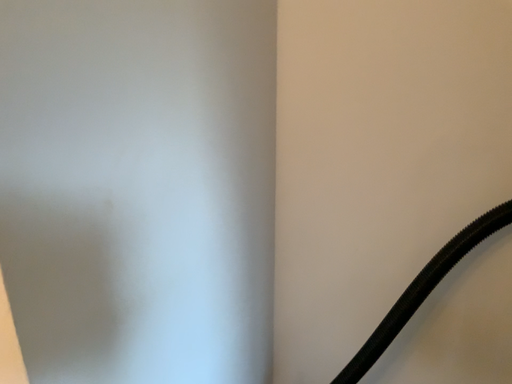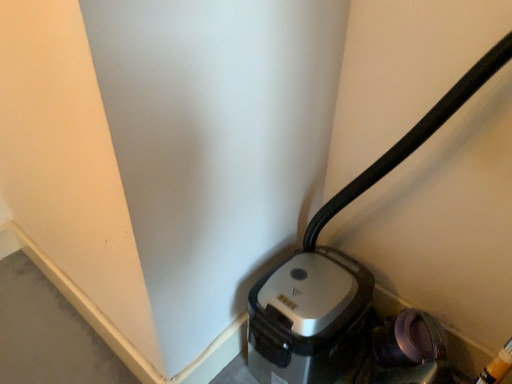
Question: Which way did the camera rotate in the video?

Choices:
 (A) rotated upward
 (B) rotated downward

Answer: (B)